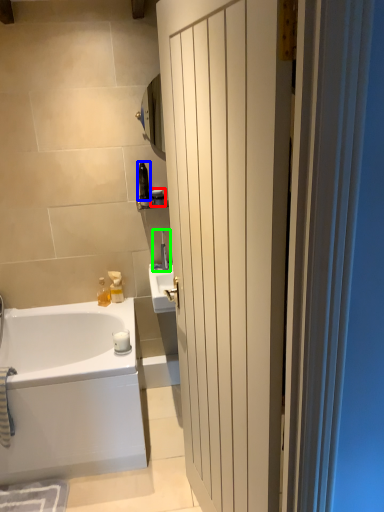
Question: Which object is positioned closest to toiletry (highlighted by a red box)? Select from toiletry (highlighted by a blue box) and faucet (highlighted by a green box).

Choices:
 (A) toiletry
 (B) faucet

Answer: (A)